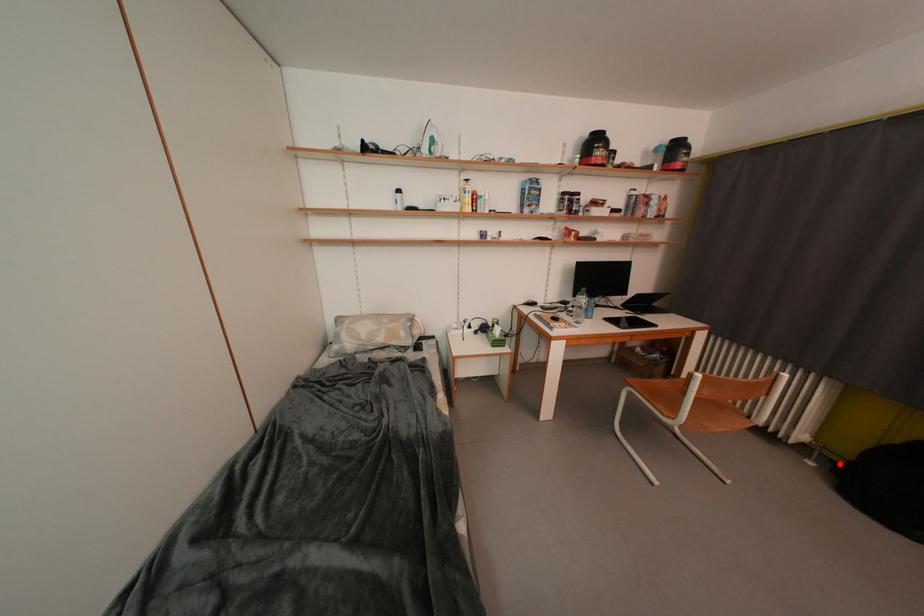
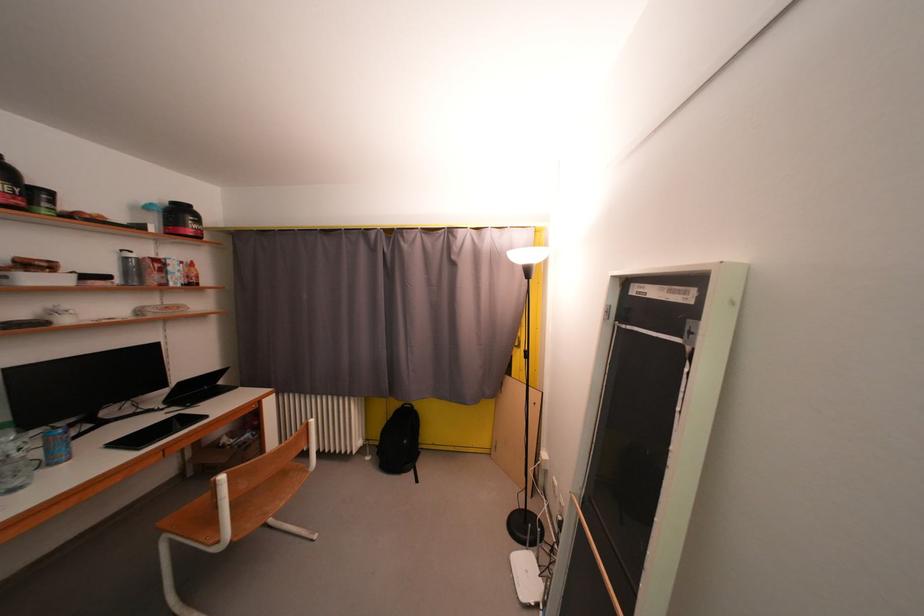
Where in the second image is the point corresponding to the highlighted location from the first image?

(384, 450)